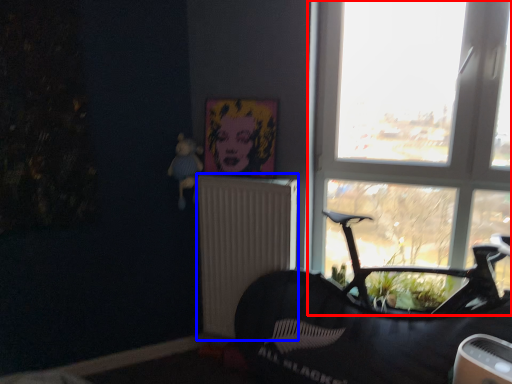
Question: Among these objects, which one is farthest to the camera, window (highlighted by a red box) or radiator (highlighted by a blue box)?

Choices:
 (A) window
 (B) radiator

Answer: (B)